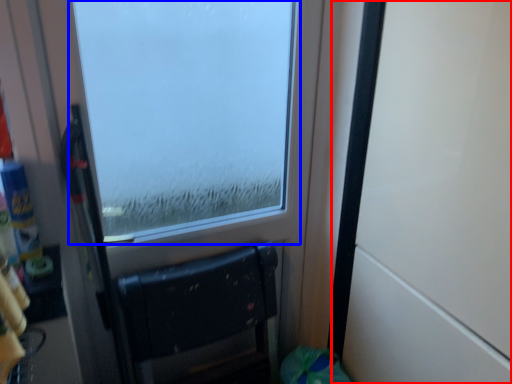
Question: Which of the following is the closest to the observer, door (highlighted by a red box) or window (highlighted by a blue box)?

Choices:
 (A) door
 (B) window

Answer: (A)